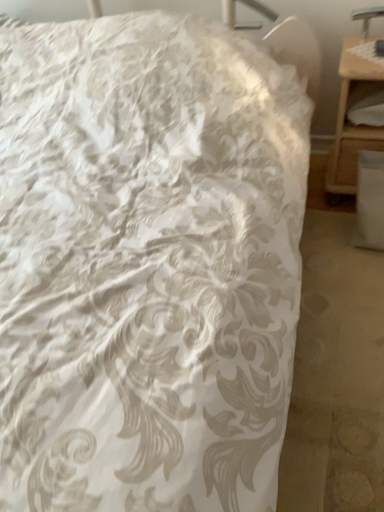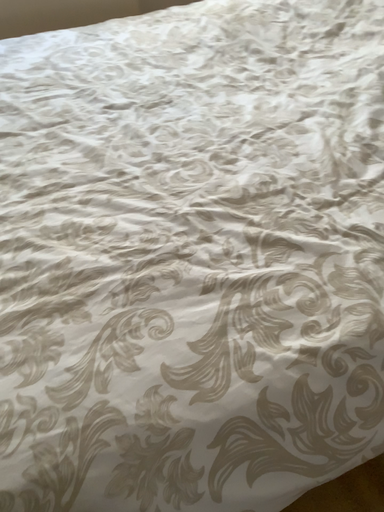
Question: How did the camera likely rotate when shooting the video?

Choices:
 (A) rotated right
 (B) rotated left

Answer: (B)